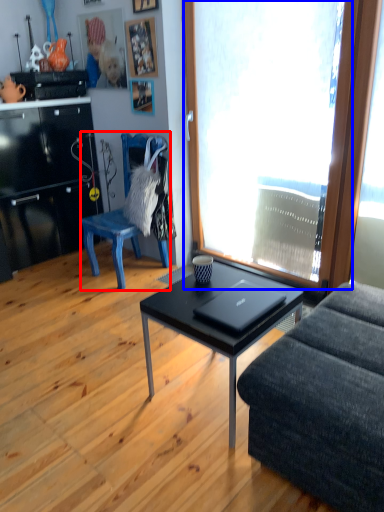
Question: Which of the following is the closest to the observer, chair (highlighted by a red box) or window (highlighted by a blue box)?

Choices:
 (A) chair
 (B) window

Answer: (B)